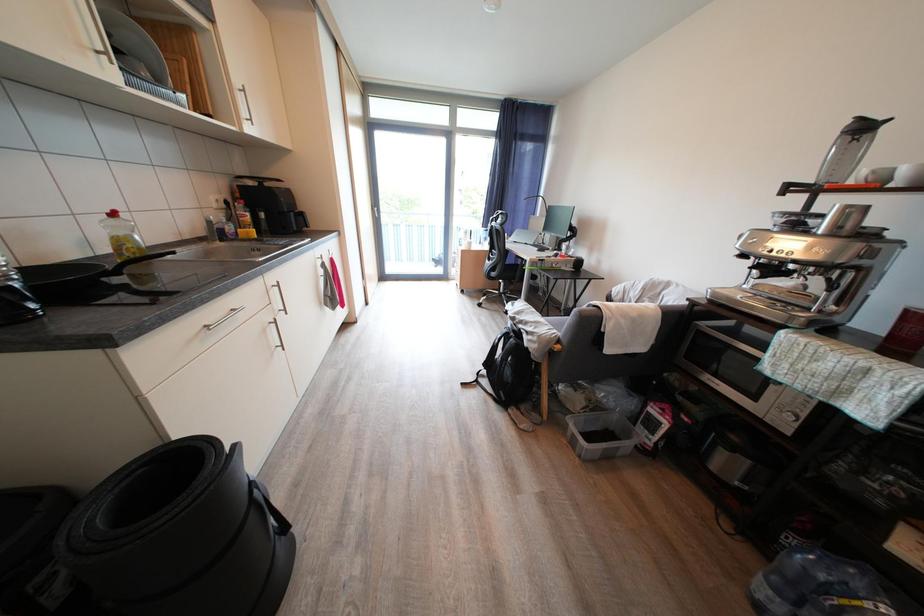
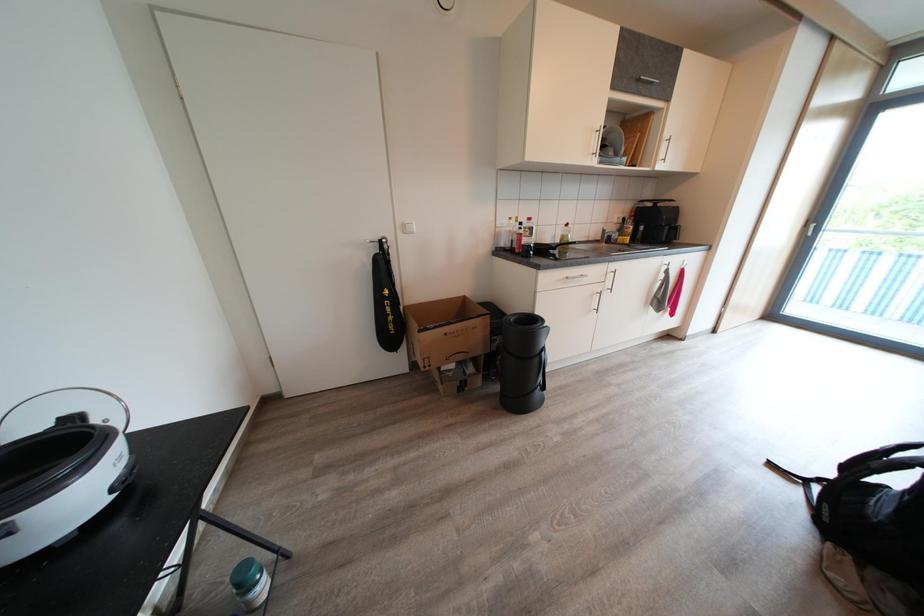
Question: The images are taken continuously from a first-person perspective. In which direction is your viewpoint rotating?

Choices:
 (A) Left
 (B) Right
 (C) Up
 (D) Down

Answer: (A)